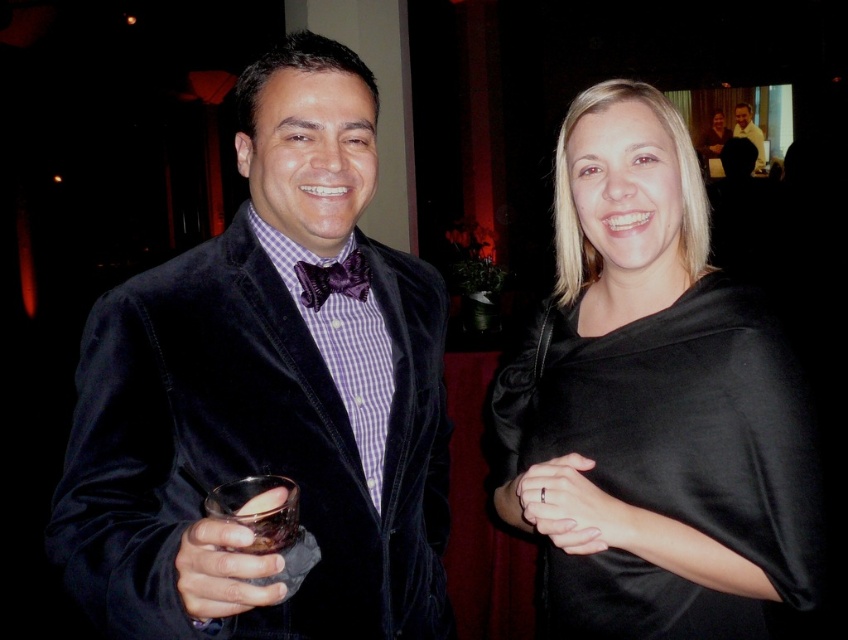
You are organizing a charity event and need to place a decorative ring on a table. The velvet black jacket at left is currently on a mannequin next to the table. If you want to ensure the black satin ring at center can fit on the table without overlapping the jacket, which object should you consider the size of when planning the space?

The velvet black jacket at left is wider than the black satin ring at center. To ensure the ring fits without overlapping, you should consider the size of the velvet black jacket at left when planning the space, as it takes up more space.

You are a photographer at a formal event. You need to place a small decorative item between the black satin ring at center and the matte black bow tie at upper right. Which object should you place it closer to to ensure it doesn

The black satin ring at center occupies less space than the matte black bow tie at upper right, so placing the decorative item closer to the black satin ring at center would ensure it doesn